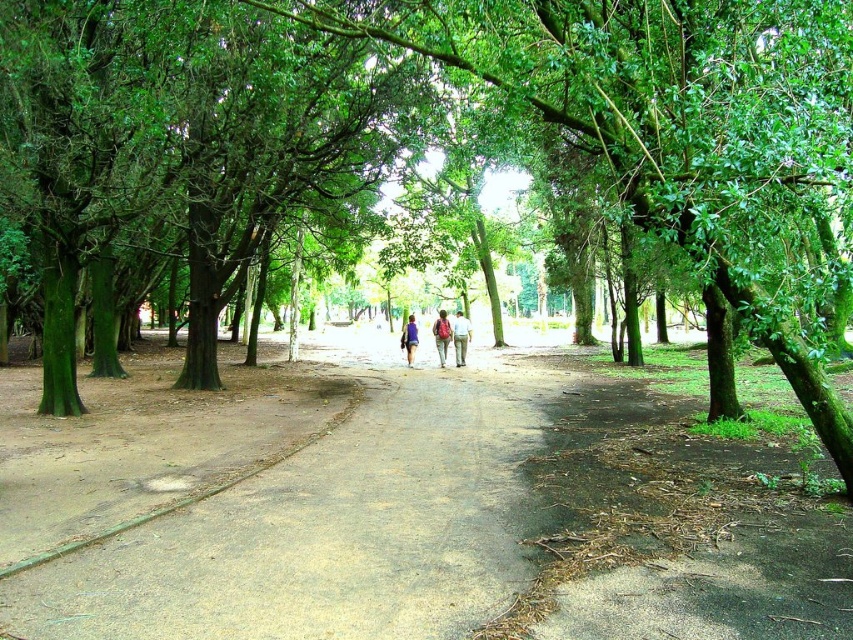
Question: Considering the real-world distances, which object is closest to the light blue denim jeans at center?

Choices:
 (A) matte green backpacks at center
 (B) matte pink backpack at center
 (C) blue fabric backpack at center

Answer: (B)

Question: Which is nearer to the light blue denim jeans at center?

Choices:
 (A) matte green backpacks at center
 (B) matte pink backpack at center

Answer: (B)

Question: Does matte pink backpack at center have a larger size compared to blue fabric backpack at center?

Choices:
 (A) yes
 (B) no

Answer: (B)

Question: Which point is farther from the camera taking this photo?

Choices:
 (A) click(448, 326)
 (B) click(407, 353)
 (C) click(434, 346)

Answer: (C)

Question: Is matte pink backpack at center further to the viewer compared to blue fabric backpack at center?

Choices:
 (A) no
 (B) yes

Answer: (A)

Question: Is the position of matte green backpacks at center more distant than that of matte pink backpack at center?

Choices:
 (A) no
 (B) yes

Answer: (A)